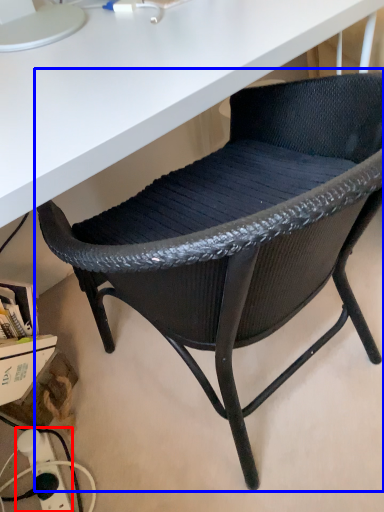
Question: Among these objects, which one is nearest to the camera, electric outlet (highlighted by a red box) or chair (highlighted by a blue box)?

Choices:
 (A) electric outlet
 (B) chair

Answer: (B)